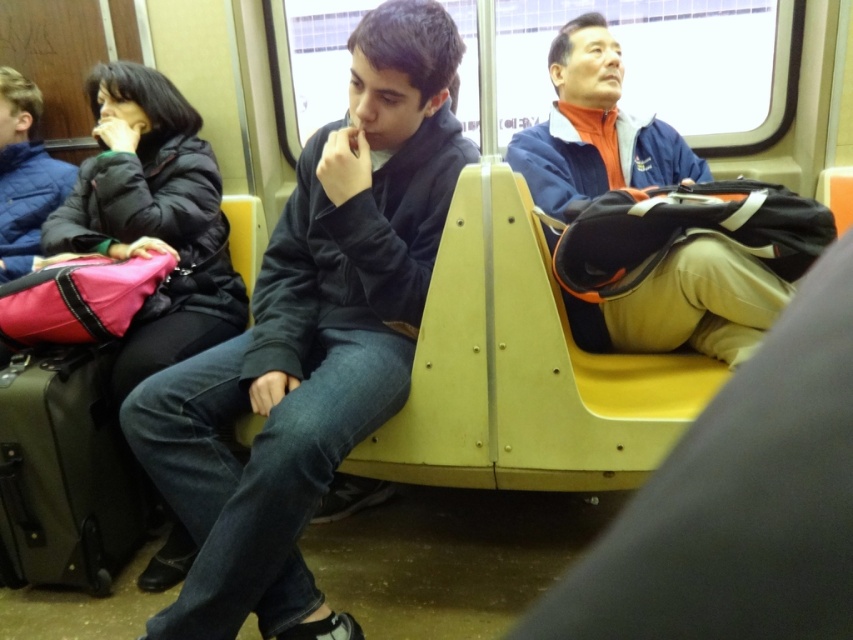
Between blue fabric jacket at right and olive green fabric suitcase at lower left, which one is positioned lower?

olive green fabric suitcase at lower left is lower down.

Which is in front, point (666, 304) or point (35, 449)?

Point (666, 304)

Between point (614, 67) and point (68, 349), which one is positioned in front?

Point (68, 349)

The height and width of the screenshot is (640, 853). In order to click on blue fabric jacket at right in this screenshot , I will do pos(595,129).

Does dark blue hoodie at center have a lesser width compared to olive green fabric suitcase at lower left?

Incorrect, dark blue hoodie at center's width is not less than olive green fabric suitcase at lower left's.

Is dark blue hoodie at center to the right of olive green fabric suitcase at lower left from the viewer's perspective?

Yes, dark blue hoodie at center is to the right of olive green fabric suitcase at lower left.

Is point (314, 236) farther from camera compared to point (59, 445)?

No, it is not.

This screenshot has height=640, width=853. Find the location of `dark blue hoodie at center`. dark blue hoodie at center is located at coordinates (310, 339).

Is point (244, 547) farther from camera compared to point (637, 150)?

That is False.

Which of these two, dark blue hoodie at center or blue fabric jacket at right, stands taller?

dark blue hoodie at center is taller.

Who is more distant from viewer, [384,29] or [572,124]?

The point [572,124] is more distant.

Where is `dark blue hoodie at center`? dark blue hoodie at center is located at coordinates (310, 339).